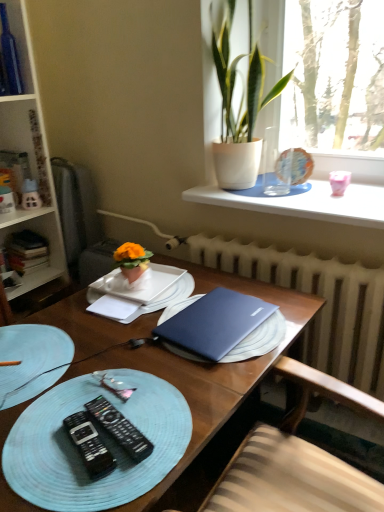
Locate an element on the screen. The width and height of the screenshot is (384, 512). vacant space positioned to the left of black plastic remote control at lower left, which ranks as the second remote control in left-to-right order is located at coordinates (41, 431).